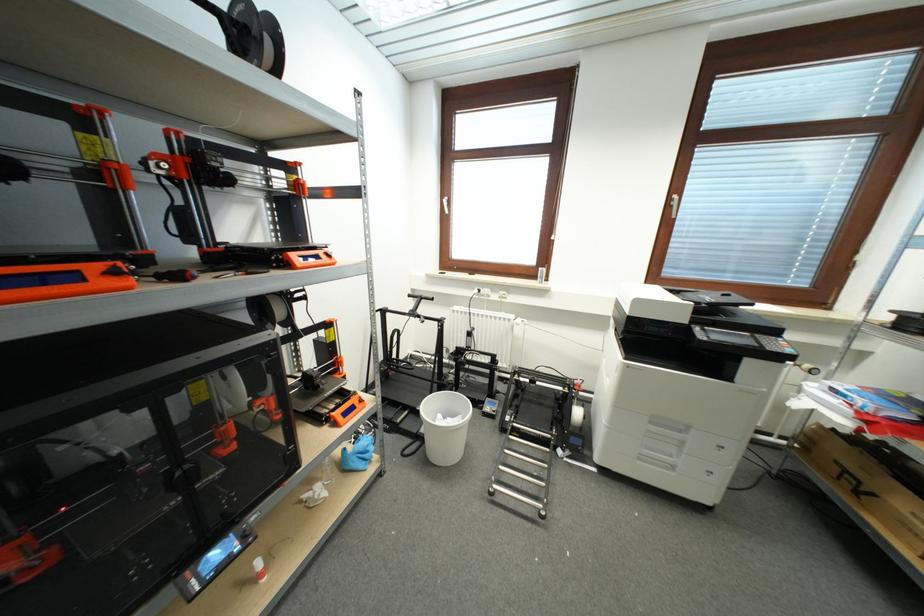
Which object does [444,426] point to?

This point indicates the white trash can.